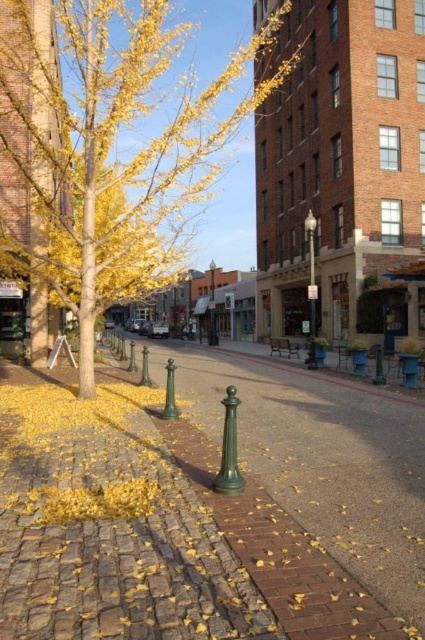
You are a pedestrian standing on the cobblestone pavement in the middle of the street. You want to walk towards the yellow leafy tree at center and the green metallic lamp post at center. Which object will you reach first?

The yellow leafy tree at center is positioned on the left side of the green metallic lamp post at center, so you will reach the yellow leafy tree at center first if you walk towards them from the middle of the street.

Based on the scene description, where is the yellow leafy tree located in relation to the point marked at coordinates (110, 147)?

The yellow leafy tree at center is located at the coordinates point (110, 147).

You are a delivery person trying to park your bike. You see the brick pavement at center and the green metallic lamp post at center. Which object is located above the other?

The green metallic lamp post at center is located above the brick pavement at center because the brick pavement at center is positioned under it.